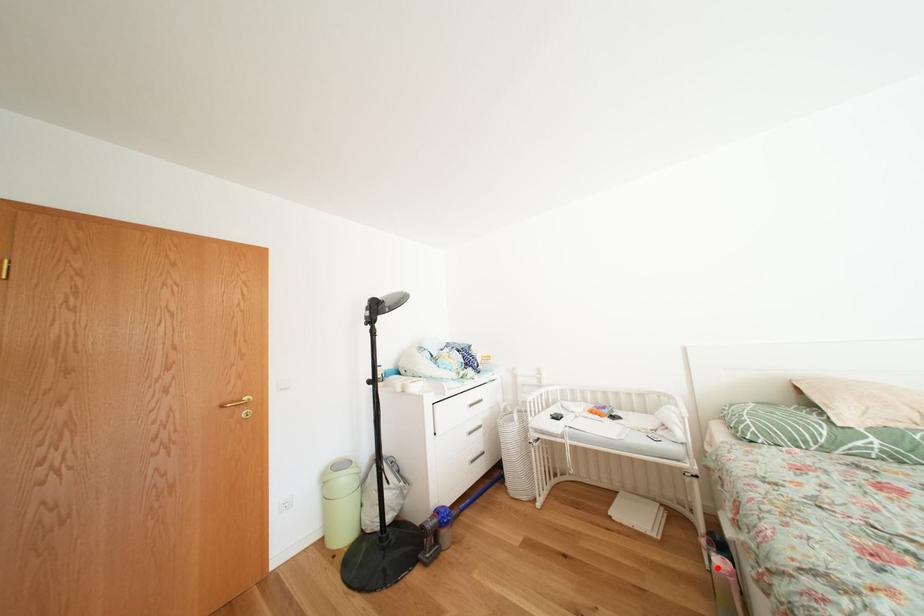
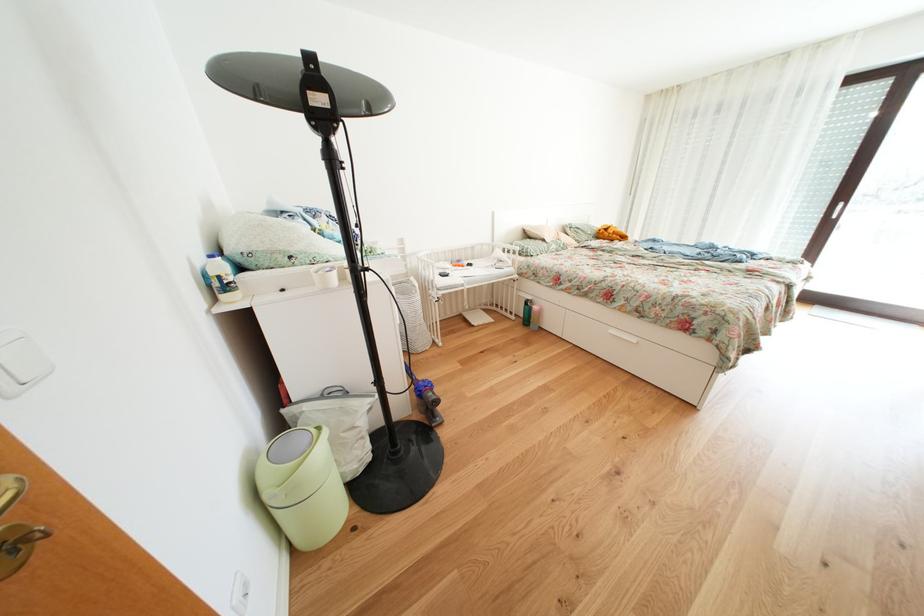
The point at the highlighted location is marked in the first image. Where is the corresponding point in the second image?

(523, 323)